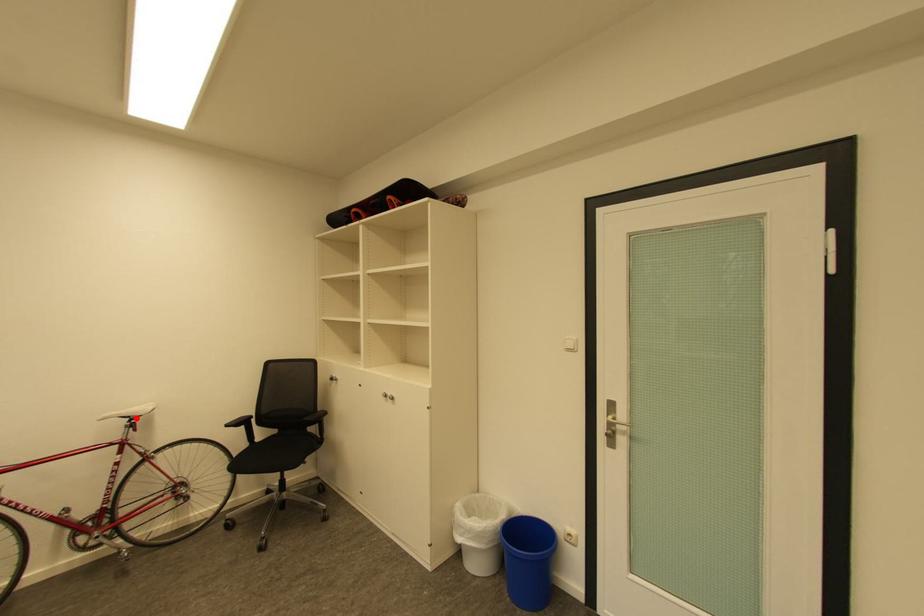
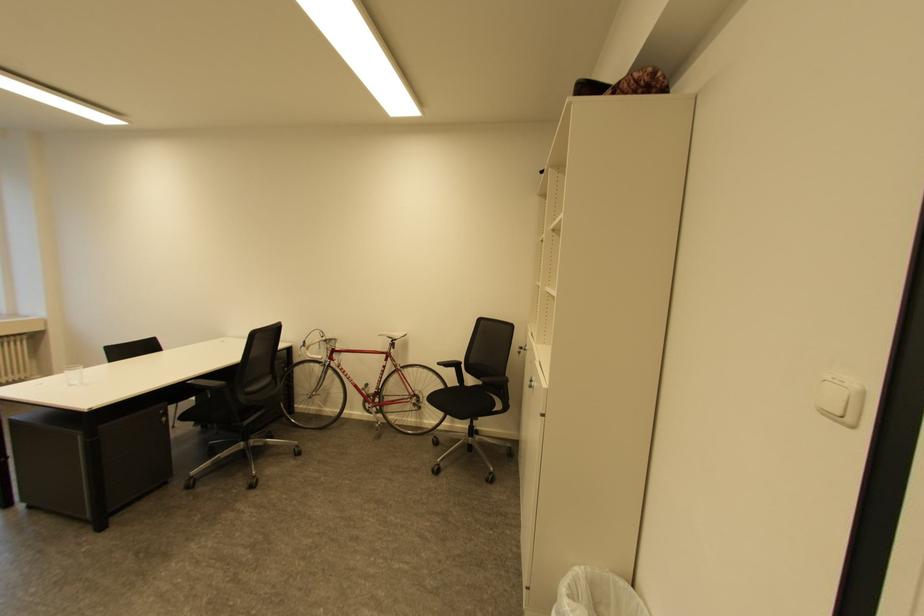
In the second image, find the point that corresponds to the highlighted location in the first image.

(398, 339)